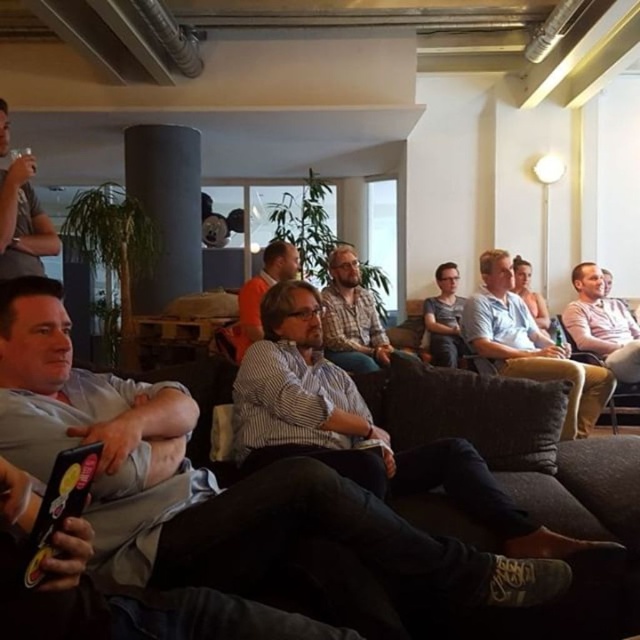
Question: Which of the following is the closest to the observer?

Choices:
 (A) striped shirt at center
 (B) matte white shirt at center
 (C) matte gray shirt at upper left
 (D) plaid shirt at center

Answer: (C)

Question: Does striped cotton shirt at center have a greater width compared to plaid shirt at center?

Choices:
 (A) no
 (B) yes

Answer: (B)

Question: Which object is the closest to the gray cotton shirt at left?

Choices:
 (A) plaid shirt at center
 (B) pink cotton shirt at right
 (C) matte gray shirt at center

Answer: (A)

Question: Does striped shirt at center have a lesser width compared to matte white shirt at center?

Choices:
 (A) yes
 (B) no

Answer: (B)

Question: Does striped cotton shirt at center have a lesser width compared to plaid shirt at center?

Choices:
 (A) no
 (B) yes

Answer: (A)

Question: Which object is the closest to the striped shirt at center?

Choices:
 (A) plaid shirt at center
 (B) gray cotton shirt at left
 (C) matte white shirt at center

Answer: (A)